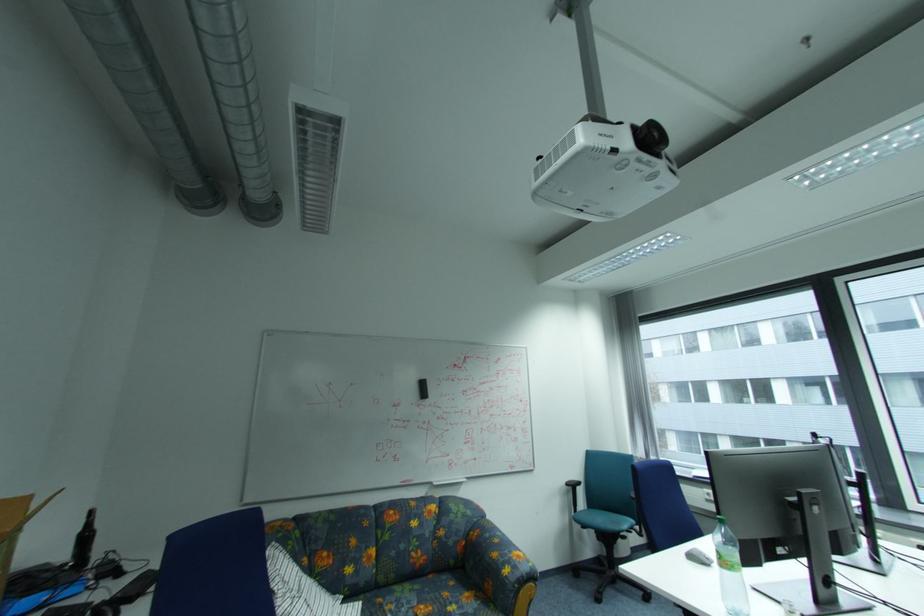
Identify the location of black whiteboard eraser. This screenshot has width=924, height=616. (421, 389).